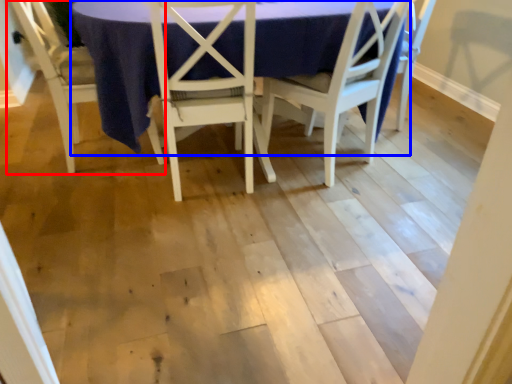
Question: Which object appears closest to the camera in this image, chair (highlighted by a red box) or round table (highlighted by a blue box)?

Choices:
 (A) chair
 (B) round table

Answer: (B)